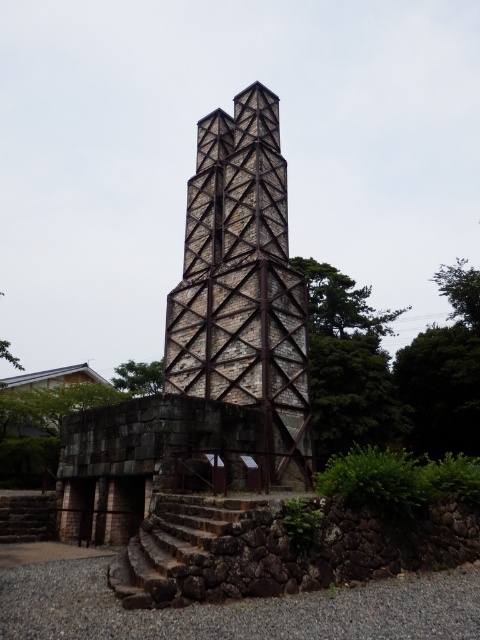
Based on the scene description, where is the stone textured bell tower at center located in terms of its 2D coordinates?

The stone textured bell tower at center is located at the 2D coordinates of point (242, 284).

You are standing in front of the monument and want to take a photo that includes both the stone textured bell tower at center and the green leafy tree at upper center. Which object should you focus on first to ensure both are in frame?

The stone textured bell tower at center is much taller than the green leafy tree at upper center, so you should focus on the stone textured bell tower at center first to ensure both are in frame.

You are standing in front of the historical monument and want to determine which of the two points, point (x=278, y=244) or point (x=218, y=520), is closer to you. Which point is nearer?

Point (x=278, y=244) is closer to you because it is further to the viewer than point (x=218, y=520).